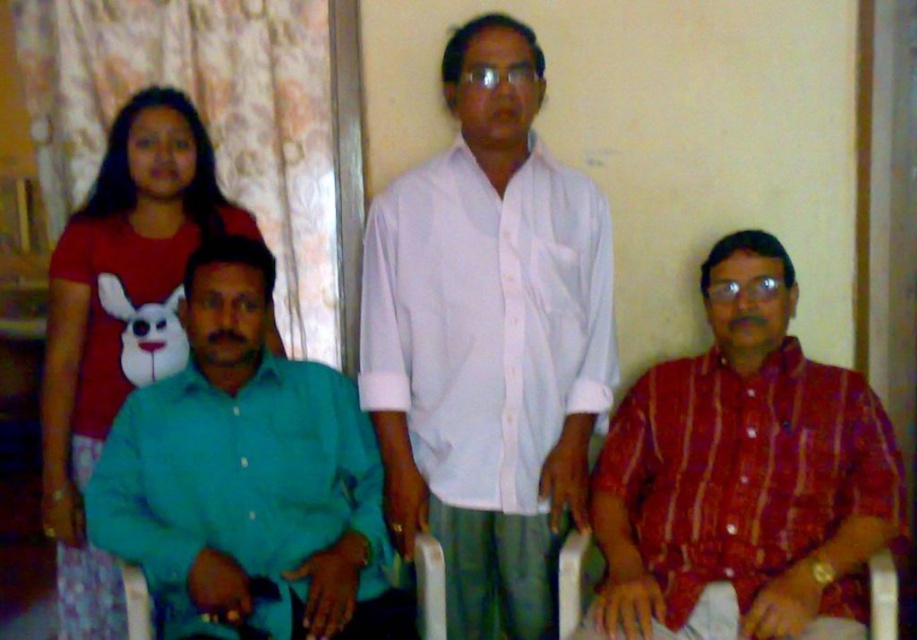
Question: Which object appears closest to the camera in this image?

Choices:
 (A) teal matte shirt at lower left
 (B) teal cotton shirt at left
 (C) white cotton shirt at center

Answer: (A)

Question: Does striped cotton shirt at right have a greater width compared to teal cotton shirt at left?

Choices:
 (A) no
 (B) yes

Answer: (B)

Question: Which point is farther to the camera?

Choices:
 (A) striped cotton shirt at right
 (B) teal cotton shirt at left
 (C) white cotton shirt at center

Answer: (B)

Question: From the image, what is the correct spatial relationship of teal matte shirt at lower left in relation to teal cotton shirt at left?

Choices:
 (A) right
 (B) left

Answer: (A)

Question: Considering the relative positions of white cotton shirt at center and teal matte shirt at lower left in the image provided, where is white cotton shirt at center located with respect to teal matte shirt at lower left?

Choices:
 (A) left
 (B) right

Answer: (B)

Question: Which of the following is the closest to the observer?

Choices:
 (A) (688, 413)
 (B) (92, 296)

Answer: (A)